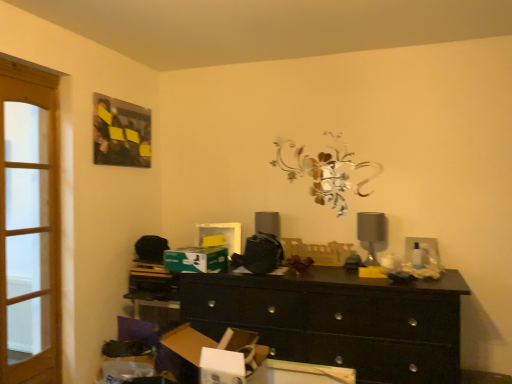
Question: Can you confirm if green cardboard box at center, the 1th cardboard box positioned from the top, is taller than light brown wooden screen door at left?

Choices:
 (A) yes
 (B) no

Answer: (B)

Question: From the image's perspective, does green cardboard box at center, which appears as the second cardboard box when viewed from the front, appear lower than light brown wooden screen door at left?

Choices:
 (A) yes
 (B) no

Answer: (A)

Question: Can light brown wooden screen door at left be found inside green cardboard box at center, marked as the 2th cardboard box in a bottom-to-top arrangement?

Choices:
 (A) yes
 (B) no

Answer: (B)

Question: Can you confirm if green cardboard box at center, arranged as the 1th cardboard box when viewed from the back, is bigger than light brown wooden screen door at left?

Choices:
 (A) no
 (B) yes

Answer: (A)

Question: Is green cardboard box at center, which appears as the second cardboard box when viewed from the front, far away from light brown wooden screen door at left?

Choices:
 (A) no
 (B) yes

Answer: (A)

Question: In the image, is matte black table lamp at right positioned in front of or behind yellow plastic tray at center?

Choices:
 (A) behind
 (B) front

Answer: (B)

Question: Is matte black table lamp at right bigger or smaller than yellow plastic tray at center?

Choices:
 (A) small
 (B) big

Answer: (B)

Question: From a real-world perspective, relative to yellow plastic tray at center, is matte black table lamp at right vertically above or below?

Choices:
 (A) above
 (B) below

Answer: (A)

Question: Considering the positions of matte black table lamp at right and yellow plastic tray at center in the image, is matte black table lamp at right wider or thinner than yellow plastic tray at center?

Choices:
 (A) thin
 (B) wide

Answer: (B)

Question: In the image, is yellow plastic tray at center positioned in front of or behind light brown wooden screen door at left?

Choices:
 (A) front
 (B) behind

Answer: (B)

Question: From the image's perspective, is yellow plastic tray at center positioned above or below light brown wooden screen door at left?

Choices:
 (A) above
 (B) below

Answer: (B)

Question: Which is correct: yellow plastic tray at center is inside light brown wooden screen door at left, or outside of it?

Choices:
 (A) outside
 (B) inside

Answer: (A)

Question: Considering the positions of yellow plastic tray at center and light brown wooden screen door at left in the image, is yellow plastic tray at center wider or thinner than light brown wooden screen door at left?

Choices:
 (A) thin
 (B) wide

Answer: (A)

Question: Based on their positions, is cardboard box at lower left, positioned as the 2th cardboard box in top-to-bottom order, located to the left or right of light brown wooden screen door at left?

Choices:
 (A) right
 (B) left

Answer: (A)

Question: Considering their positions, is cardboard box at lower left, arranged as the first cardboard box when viewed from the front, located in front of or behind light brown wooden screen door at left?

Choices:
 (A) behind
 (B) front

Answer: (B)